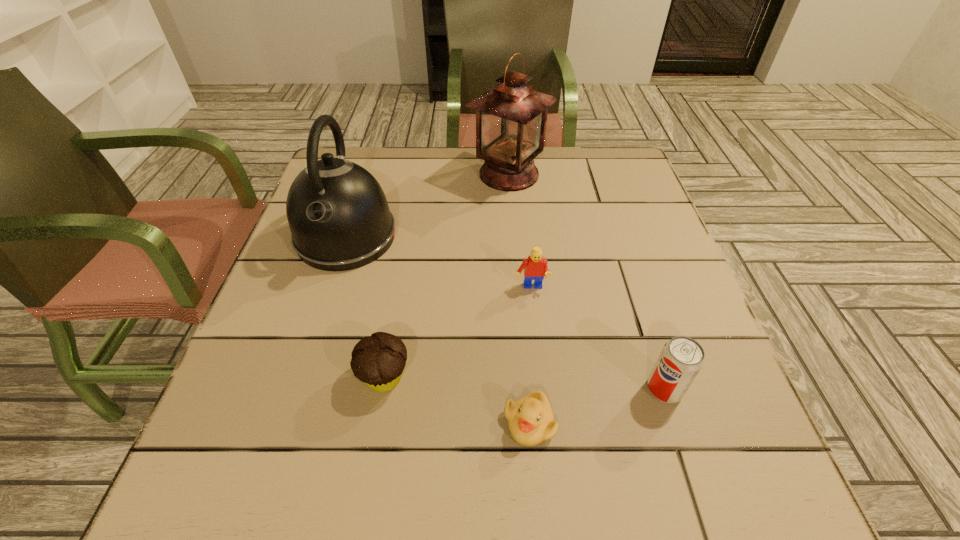
In order to click on oil lamp in this screenshot , I will do `click(511, 117)`.

What are the coordinates of `the second farthest object` in the screenshot? It's located at (339, 218).

Locate an element on the screen. The image size is (960, 540). soda is located at coordinates (681, 359).

Where is `the fourth nearest object`? the fourth nearest object is located at coordinates (535, 267).

Locate an element on the screen. This screenshot has width=960, height=540. the second shortest object is located at coordinates (378, 360).

The width and height of the screenshot is (960, 540). In order to click on duckling in this screenshot , I will do `click(530, 420)`.

Where is `free spot located on the left of the farthest object`? Image resolution: width=960 pixels, height=540 pixels. free spot located on the left of the farthest object is located at coordinates (328, 174).

The width and height of the screenshot is (960, 540). In order to click on free space located on the spout of the kettle in this screenshot , I will do `click(317, 330)`.

I want to click on free space located 0.180m on the left of the soda, so click(542, 389).

The image size is (960, 540). I want to click on free spot located on the front-facing side of the Lego, so click(x=546, y=434).